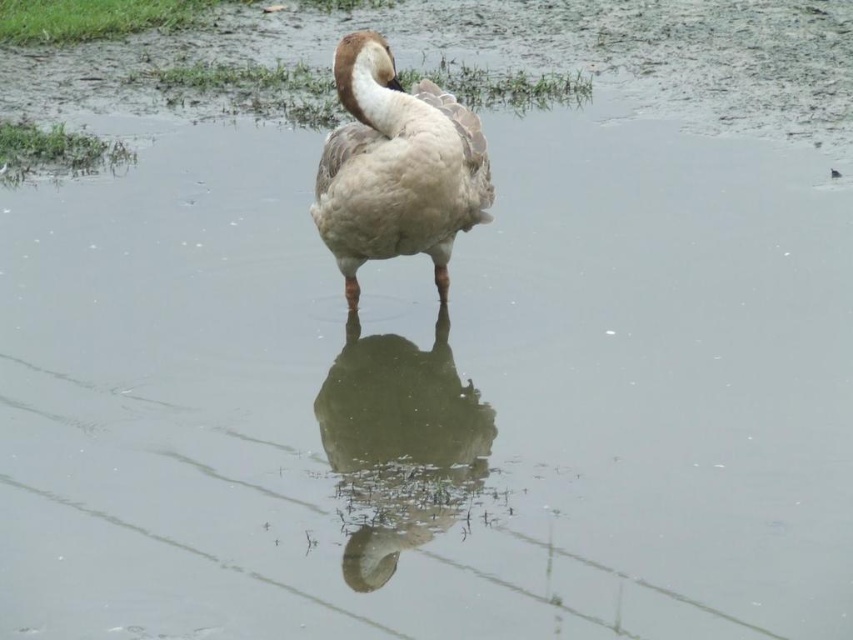
Is brown matte duck at center closer to the viewer compared to brown feathered duck at center?

Yes, it is in front of brown feathered duck at center.

Can you confirm if brown matte duck at center is thinner than brown feathered duck at center?

Indeed, brown matte duck at center has a lesser width compared to brown feathered duck at center.

I want to click on brown matte duck at center, so click(399, 444).